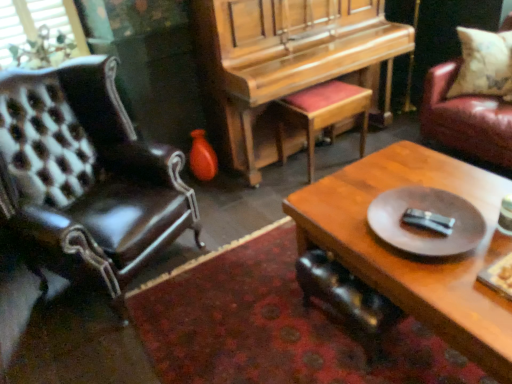
The image size is (512, 384). Find the location of `free region on the left part of shiny black leather chair at lower center, marked as the 1th chair in a right-to-left arrangement`. free region on the left part of shiny black leather chair at lower center, marked as the 1th chair in a right-to-left arrangement is located at coordinates (276, 333).